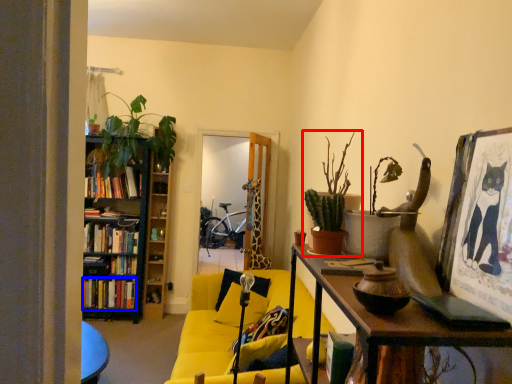
Question: Which object appears closest to the camera in this image, houseplant (highlighted by a red box) or book (highlighted by a blue box)?

Choices:
 (A) houseplant
 (B) book

Answer: (A)